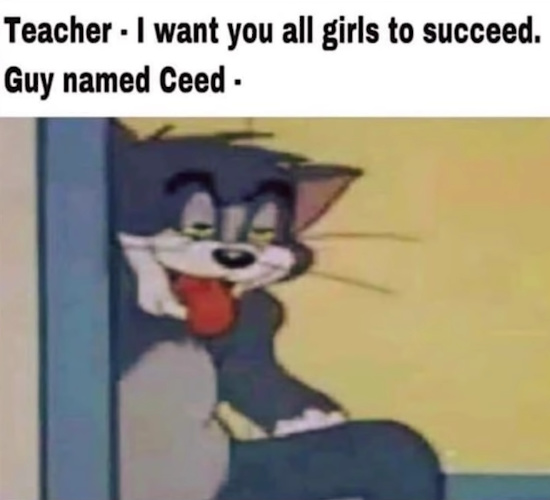
Locate an element on the screen. This screenshot has height=500, width=550. beige wall is located at coordinates (19, 298).